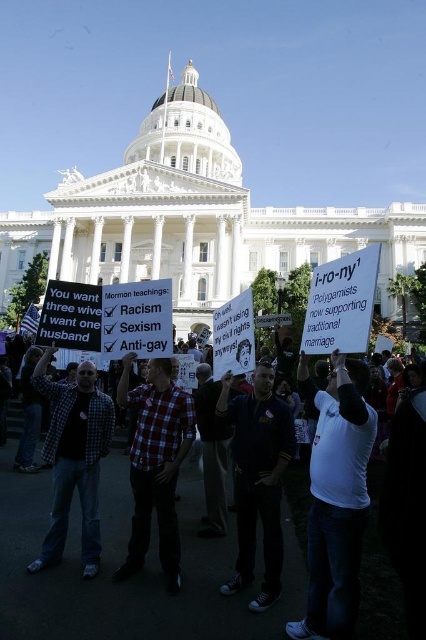
Question: Among these objects, which one is nearest to the camera?

Choices:
 (A) white paper signs at center
 (B) plaid shirt at center
 (C) white t-shirt at center
 (D) dark blue shirt at center

Answer: (A)

Question: Can you confirm if white t-shirt at center is smaller than checkered fabric shirt at center?

Choices:
 (A) yes
 (B) no

Answer: (B)

Question: Estimate the real-world distances between objects in this image. Which object is farther from the white paper signs at center?

Choices:
 (A) white t-shirt at center
 (B) plaid shirt at center
 (C) dark blue shirt at center
 (D) checkered fabric shirt at center

Answer: (A)

Question: Can you confirm if white t-shirt at center is smaller than checkered fabric shirt at center?

Choices:
 (A) no
 (B) yes

Answer: (A)

Question: Considering the real-world distances, which object is closest to the white t-shirt at center?

Choices:
 (A) white paper signs at center
 (B) dark blue shirt at center
 (C) checkered fabric shirt at center
 (D) plaid shirt at center

Answer: (B)

Question: Does dark blue shirt at center appear on the left side of checkered fabric shirt at center?

Choices:
 (A) yes
 (B) no

Answer: (B)